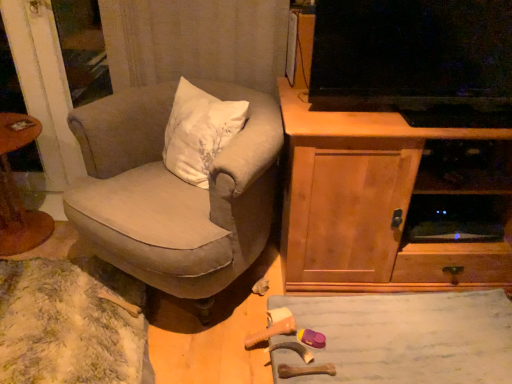
What is the approximate height of wooden toy at lower center?

wooden toy at lower center is 8.34 inches in height.

This screenshot has width=512, height=384. What are the coordinates of `wooden toy at lower center` in the screenshot? It's located at (405, 337).

Is beige fabric chair at center taller or shorter than wooden cabinet at right?

In the image, beige fabric chair at center appears to be shorter than wooden cabinet at right.

In terms of width, does beige fabric chair at center look wider or thinner when compared to wooden cabinet at right?

In the image, beige fabric chair at center appears to be more narrow than wooden cabinet at right.

Considering the positions of objects beige fabric chair at center and wooden cabinet at right in the image provided, who is in front, beige fabric chair at center or wooden cabinet at right?

beige fabric chair at center is more forward.

Is beige fabric chair at center far from wooden cabinet at right?

No, there isn't a large distance between beige fabric chair at center and wooden cabinet at right.

This screenshot has width=512, height=384. I want to click on plain in front of the wooden cabinet at right, so click(405, 337).

Looking at this image, from a real-world perspective, who is located higher, wooden toy at lower center or wooden cabinet at right?

From a 3D spatial view, wooden cabinet at right is above.

What's the angular difference between wooden toy at lower center and wooden cabinet at right's facing directions?

There is a 91.9-degree angle between the facing directions of wooden toy at lower center and wooden cabinet at right.

Consider the image. Is wooden toy at lower center far from wooden cabinet at right?

No, there isn't a large distance between wooden toy at lower center and wooden cabinet at right.

Which object is thinner, wooden cabinet at right or beige fabric chair at center?

beige fabric chair at center is thinner.

Which object is positioned more to the left, wooden cabinet at right or beige fabric chair at center?

From the viewer's perspective, beige fabric chair at center appears more on the left side.

Who is taller, wooden cabinet at right or beige fabric chair at center?

With more height is wooden cabinet at right.

From the image's perspective, is wooden cabinet at right below beige fabric chair at center?

Yes.

Image resolution: width=512 pixels, height=384 pixels. In the image, there is a wooden toy at lower center. Find the location of `table above it (from the image's perspective)`. table above it (from the image's perspective) is located at coordinates (18, 191).

Looking at this image, is wooden round table at left oriented away from wooden toy at lower center?

No, wooden round table at left is not facing the opposite direction of wooden toy at lower center.

Would you say wooden toy at lower center is part of wooden round table at left's contents?

That's incorrect, wooden toy at lower center is not inside wooden round table at left.

From the picture: Can you tell me how much wooden round table at left and wooden toy at lower center differ in facing direction?

There is a 1.81-degree angle between the facing directions of wooden round table at left and wooden toy at lower center.

Is wooden cabinet at right bigger or smaller than wooden toy at lower center?

wooden cabinet at right is bigger than wooden toy at lower center.

From a real-world perspective, is wooden cabinet at right over wooden toy at lower center?

Yes.

From the image's perspective, who appears lower, wooden cabinet at right or wooden toy at lower center?

wooden toy at lower center is shown below in the image.

Are wooden cabinet at right and wooden toy at lower center making contact?

No, wooden cabinet at right is not with wooden toy at lower center.

From the picture: Is wooden round table at left positioned with its back to wooden cabinet at right?

wooden round table at left is not turned away from wooden cabinet at right.

From the image's perspective, is wooden round table at left located above or below wooden cabinet at right?

wooden round table at left is above wooden cabinet at right.

Who is shorter, wooden round table at left or wooden cabinet at right?

wooden round table at left.

Consider the image. Are wooden round table at left and wooden cabinet at right beside each other?

No.

Could you tell me if wooden toy at lower center is turned towards beige fabric chair at center?

No.

Considering the positions of point (368, 332) and point (120, 116), is point (368, 332) closer or farther from the camera than point (120, 116)?

Point (368, 332) appears to be closer to the viewer than point (120, 116).

Where is `plain behind the beige fabric chair at center`? Image resolution: width=512 pixels, height=384 pixels. plain behind the beige fabric chair at center is located at coordinates pyautogui.click(x=405, y=337).

Is the depth of wooden toy at lower center less than that of beige fabric chair at center?

No, wooden toy at lower center is behind beige fabric chair at center.

Find the location of a particular element. chair below the wooden cabinet at right (from a real-world perspective) is located at coordinates (174, 192).

Identify the location of cabinetry above the wooden toy at lower center (from the image's perspective). (375, 205).

Looking at the image, which one is located closer to wooden round table at left, wooden cabinet at right or wooden toy at lower center?

Based on the image, wooden cabinet at right appears to be nearer to wooden round table at left.

Consider the image. When comparing their distances from wooden cabinet at right, does wooden round table at left or beige fabric chair at center seem further?

wooden round table at left lies further to wooden cabinet at right than the other object.

From the image, which object appears to be farther from beige fabric chair at center, wooden round table at left or wooden cabinet at right?

Among the two, wooden round table at left is located further to beige fabric chair at center.

Which object lies further to the anchor point wooden toy at lower center, beige fabric chair at center or wooden cabinet at right?

beige fabric chair at center is positioned further to the anchor wooden toy at lower center.

Based on their spatial positions, is wooden cabinet at right or wooden round table at left closer to beige fabric chair at center?

Based on the image, wooden cabinet at right appears to be nearer to beige fabric chair at center.

Which object lies nearer to the anchor point wooden round table at left, wooden toy at lower center or beige fabric chair at center?

beige fabric chair at center.

From the picture: Which object lies further to the anchor point wooden toy at lower center, wooden cabinet at right or wooden round table at left?

wooden round table at left is positioned further to the anchor wooden toy at lower center.

When comparing their distances from wooden cabinet at right, does wooden toy at lower center or wooden round table at left seem closer?

The object closer to wooden cabinet at right is wooden toy at lower center.

In order to click on chair located between wooden round table at left and wooden toy at lower center in the left-right direction in this screenshot , I will do (x=174, y=192).

At what (x,y) coordinates should I click in order to perform the action: click on chair between wooden round table at left and wooden cabinet at right in the horizontal direction. Please return your answer as a coordinate pair (x, y). Image resolution: width=512 pixels, height=384 pixels. Looking at the image, I should click on (174, 192).

Image resolution: width=512 pixels, height=384 pixels. Identify the location of plain situated between wooden round table at left and wooden cabinet at right from left to right. (405, 337).

At what (x,y) coordinates should I click in order to perform the action: click on plain between beige fabric chair at center and wooden cabinet at right from left to right. Please return your answer as a coordinate pair (x, y). The image size is (512, 384). Looking at the image, I should click on (405, 337).